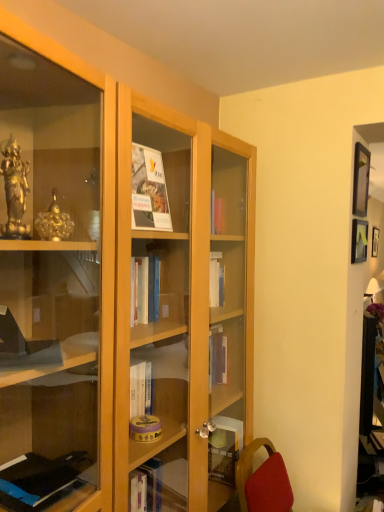
Question: Is matte black picture frame at upper right, the first picture frame viewed from the top, next to matte black picture frame at upper right, the 1th picture frame ordered from the bottom?

Choices:
 (A) no
 (B) yes

Answer: (A)

Question: From a real-world perspective, is matte black picture frame at upper right, the first picture frame viewed from the top, over matte black picture frame at upper right, which is the 2th picture frame in top-to-bottom order?

Choices:
 (A) no
 (B) yes

Answer: (B)

Question: Is matte black picture frame at upper right, arranged as the second picture frame when ordered from the bottom, thinner than matte black picture frame at upper right, which is the 2th picture frame in top-to-bottom order?

Choices:
 (A) no
 (B) yes

Answer: (A)

Question: Is matte black picture frame at upper right, arranged as the second picture frame when ordered from the bottom, turned away from matte black picture frame at upper right, the 1th picture frame ordered from the bottom?

Choices:
 (A) yes
 (B) no

Answer: (B)

Question: Is matte black picture frame at upper right, arranged as the second picture frame when ordered from the bottom, positioned beyond the bounds of matte black picture frame at upper right, the 1th picture frame ordered from the bottom?

Choices:
 (A) yes
 (B) no

Answer: (A)

Question: Considering the relative positions of matte black picture frame at upper right, arranged as the second picture frame when ordered from the bottom, and matte black picture frame at upper right, which is the 2th picture frame in top-to-bottom order, in the image provided, is matte black picture frame at upper right, arranged as the second picture frame when ordered from the bottom, to the right of matte black picture frame at upper right, which is the 2th picture frame in top-to-bottom order, from the viewer's perspective?

Choices:
 (A) yes
 (B) no

Answer: (A)

Question: Does matte black picture frame at upper right, which is the 2th picture frame in top-to-bottom order, have a lesser height compared to matte black picture frame at upper right, the first picture frame viewed from the top?

Choices:
 (A) no
 (B) yes

Answer: (B)

Question: Considering the relative sizes of matte black picture frame at upper right, the 1th picture frame ordered from the bottom, and matte black picture frame at upper right, the first picture frame viewed from the top, in the image provided, is matte black picture frame at upper right, the 1th picture frame ordered from the bottom, taller than matte black picture frame at upper right, the first picture frame viewed from the top,?

Choices:
 (A) no
 (B) yes

Answer: (A)

Question: From the image's perspective, is matte black picture frame at upper right, which is the 2th picture frame in top-to-bottom order, below matte black picture frame at upper right, the first picture frame viewed from the top?

Choices:
 (A) yes
 (B) no

Answer: (A)

Question: Would you say matte black picture frame at upper right, which is the 2th picture frame in top-to-bottom order, is a long distance from matte black picture frame at upper right, arranged as the second picture frame when ordered from the bottom?

Choices:
 (A) yes
 (B) no

Answer: (B)

Question: Considering the relative sizes of matte black picture frame at upper right, which is the 2th picture frame in top-to-bottom order, and matte black picture frame at upper right, arranged as the second picture frame when ordered from the bottom, in the image provided, is matte black picture frame at upper right, which is the 2th picture frame in top-to-bottom order, thinner than matte black picture frame at upper right, arranged as the second picture frame when ordered from the bottom,?

Choices:
 (A) no
 (B) yes

Answer: (B)

Question: Does matte black picture frame at upper right, which is the 2th picture frame in top-to-bottom order, have a greater width compared to matte black picture frame at upper right, the first picture frame viewed from the top?

Choices:
 (A) no
 (B) yes

Answer: (A)

Question: Choose the correct answer: Is matte black picture frame at upper right, the 1th picture frame ordered from the bottom, inside matte black picture frame at upper right, the first picture frame viewed from the top, or outside it?

Choices:
 (A) outside
 (B) inside

Answer: (A)